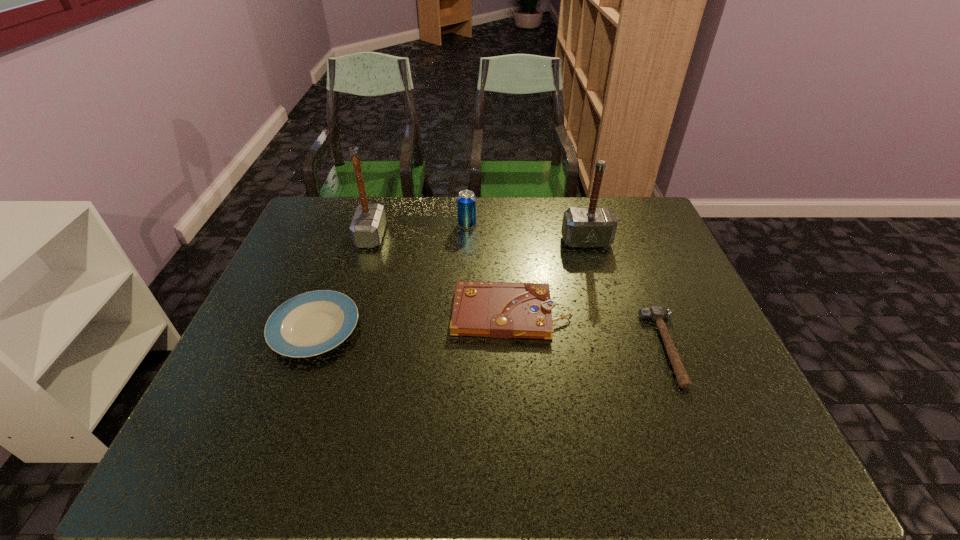
You are a GUI agent. You are given a task and a screenshot of the screen. Output one action in this format:
    pyautogui.click(x=<x>, y=<y>)
    Task: Click on the free space located 0.320m on the left of the third shortest object
    The width and height of the screenshot is (960, 540).
    Given the screenshot: What is the action you would take?
    pyautogui.click(x=329, y=313)

The width and height of the screenshot is (960, 540). I want to click on free location located 0.280m on the striking face of the rightmost object, so click(x=535, y=348).

Identify the location of vacant space located on the striking face of the rightmost object. (535, 348).

Identify the location of free spot located on the striking face of the rightmost object. The width and height of the screenshot is (960, 540). (572, 348).

This screenshot has width=960, height=540. Identify the location of vacant region located 0.050m on the left of the plate. (251, 328).

Find the location of a particular element. beer can located in the far edge section of the desktop is located at coordinates (466, 201).

I want to click on object at the left edge, so click(x=309, y=324).

I want to click on object located at the right edge, so click(656, 313).

You are a GUI agent. You are given a task and a screenshot of the screen. Output one action in this format:
    pyautogui.click(x=<x>, y=<y>)
    Task: Click on the vacant space at the far edge of the desktop
    The image size is (960, 540).
    Given the screenshot: What is the action you would take?
    pyautogui.click(x=387, y=231)

At what (x,y) coordinates should I click in order to perform the action: click on free region at the near edge of the desktop. Please return your answer as a coordinate pair (x, y). Looking at the image, I should click on (398, 475).